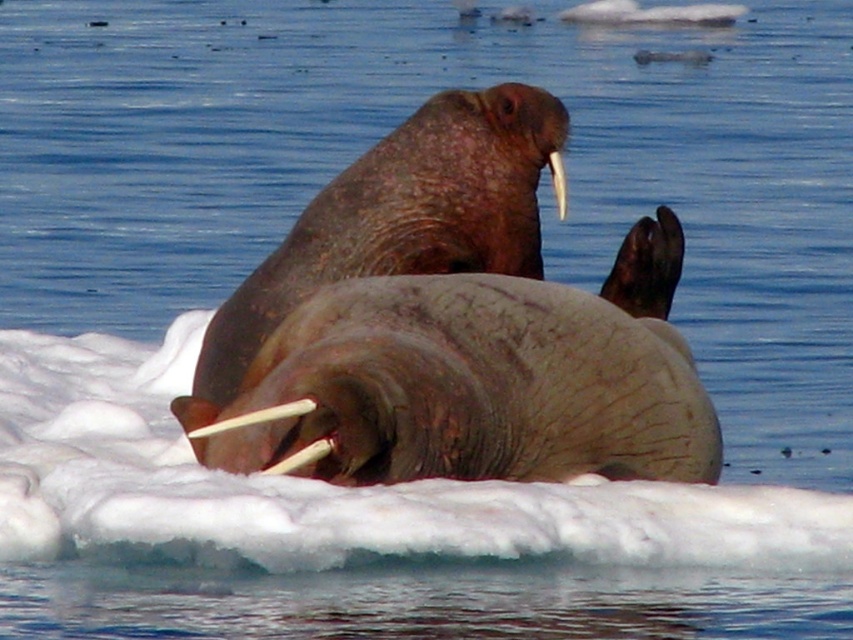
Does gray textured walrus at center come in front of white ivory tusk at center?

No.

Who is more forward, (668, 433) or (285, 408)?

Positioned in front is point (285, 408).

Is point (556, 328) less distant than point (312, 404)?

No, it is behind (312, 404).

You are a GUI agent. You are given a task and a screenshot of the screen. Output one action in this format:
    pyautogui.click(x=<x>, y=<y>)
    Task: Click on the gray textured walrus at center
    The height and width of the screenshot is (640, 853).
    Given the screenshot: What is the action you would take?
    pyautogui.click(x=480, y=378)

Which of these two, gray textured walrus at center or white ivory tusk at lower center, stands taller?

gray textured walrus at center is taller.

Which is behind, point (332, 428) or point (273, 474)?

The point (332, 428) is more distant.

Locate an element on the screen. gray textured walrus at center is located at coordinates (480, 378).

This screenshot has width=853, height=640. I want to click on gray textured walrus at center, so click(x=480, y=378).

Which of these two, white ivory tusk at center or white ivory tusk at upper center, stands shorter?

With less height is white ivory tusk at center.

Can you confirm if white ivory tusk at center is smaller than white ivory tusk at upper center?

No, white ivory tusk at center is not smaller than white ivory tusk at upper center.

Identify the location of white ivory tusk at center. The width and height of the screenshot is (853, 640). (254, 417).